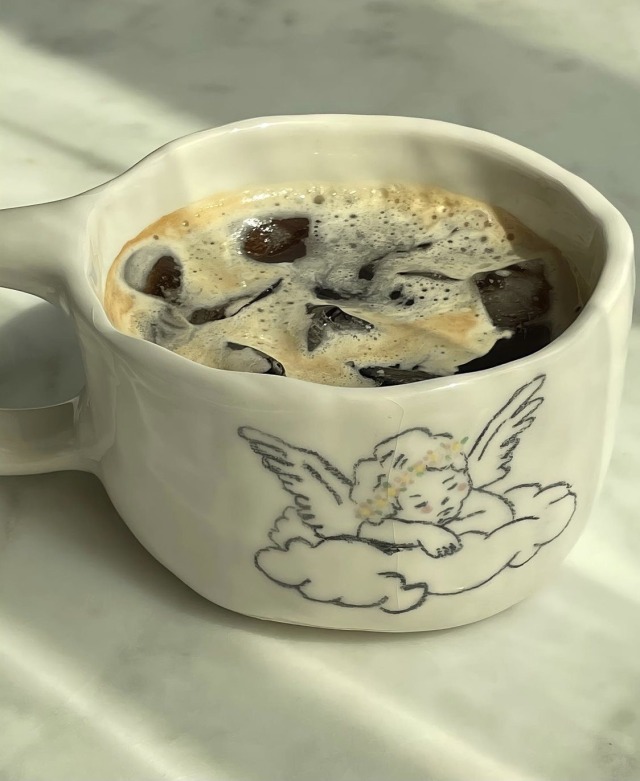
Where is `foam`? The image size is (640, 781). foam is located at coordinates (275, 330).